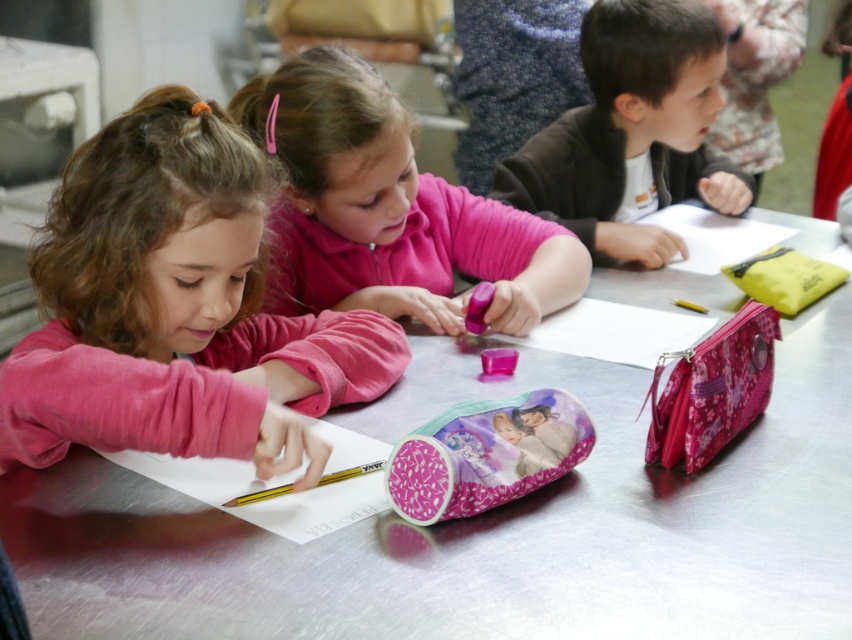
Question: Does metallic silver table at center have a larger size compared to pink matte pencil case at center?

Choices:
 (A) yes
 (B) no

Answer: (A)

Question: Which object appears farthest from the camera in this image?

Choices:
 (A) matte black jacket at upper right
 (B) metallic silver table at center
 (C) pink matte pencil case at center

Answer: (A)

Question: Is metallic silver table at center positioned at the back of pink fabric child at center?

Choices:
 (A) yes
 (B) no

Answer: (B)

Question: Which of the following is the farthest from the observer?

Choices:
 (A) click(19, 456)
 (B) click(850, 381)
 (C) click(718, 76)
 (D) click(298, 154)

Answer: (C)

Question: Which point is farther from the camera taking this photo?

Choices:
 (A) (113, 125)
 (B) (787, 636)

Answer: (A)

Question: Is pink fabric child at center bigger than matte black jacket at upper right?

Choices:
 (A) yes
 (B) no

Answer: (B)